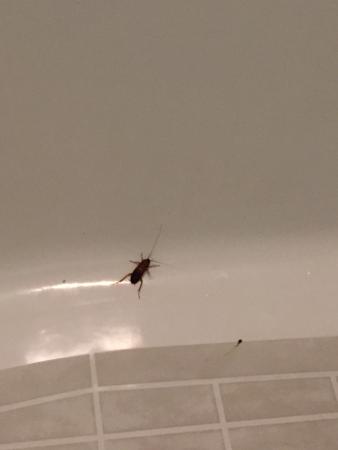
At what (x,y) coordinates should I click in order to perform the action: click on kitchen. Please return your answer as a coordinate pair (x, y). The image size is (338, 450). Looking at the image, I should click on (241, 363).